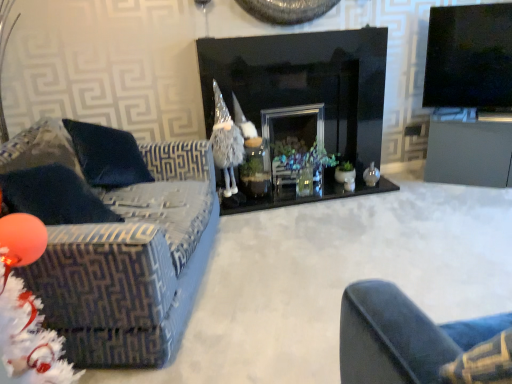
Find the location of `free space to the left of matte gray table at right`. free space to the left of matte gray table at right is located at coordinates (417, 192).